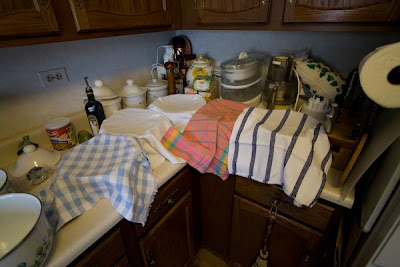
Find the location of `paper towels`. paper towels is located at coordinates (373, 70).